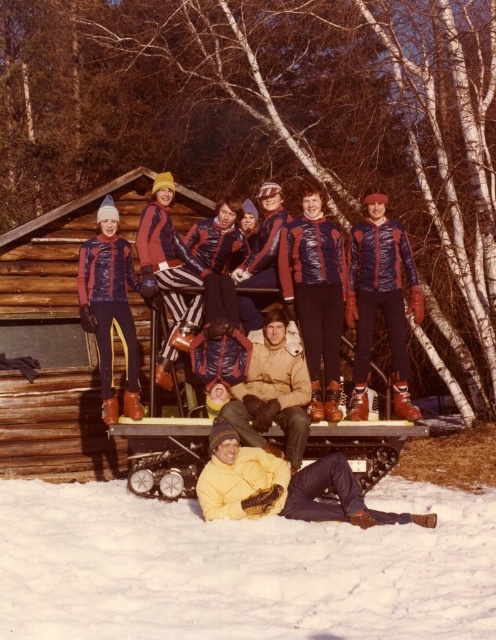
You are standing at the origin point of the coordinate system in the image. The yellow matte jacket at lower center is represented by point (284, 486). Can you determine the direction you need to move to reach it?

The yellow matte jacket at lower center is located at coordinates (284, 486). Since the origin is at the bottom left corner of the image, you would need to move to the right and slightly upwards to reach it.

You are a photographer trying to capture a group photo of the matte blue ski suit at left and the tan suede jacket at center. The camera you are using has a maximum focus range of 6 feet. Can you fit both subjects within the camera frame without moving either of them?

The distance between the matte blue ski suit at left and the tan suede jacket at center is 5.87 feet, which is within the camera maximum focus range of 6 feet. Therefore, you can fit both subjects within the camera frame without moving them.